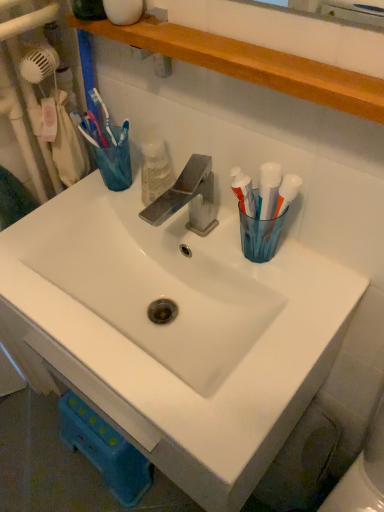
Question: From a real-world perspective, is white ceramic sink at center positioned under translucent plastic toothbrush at upper left based on gravity?

Choices:
 (A) yes
 (B) no

Answer: (A)

Question: From the image's perspective, does white ceramic sink at center appear higher than translucent plastic toothbrush at upper left?

Choices:
 (A) no
 (B) yes

Answer: (A)

Question: Considering the relative positions of white ceramic sink at center and translucent plastic toothbrush at upper left in the image provided, is white ceramic sink at center behind translucent plastic toothbrush at upper left?

Choices:
 (A) yes
 (B) no

Answer: (B)

Question: Is white ceramic sink at center turned away from translucent plastic toothbrush at upper left?

Choices:
 (A) no
 (B) yes

Answer: (A)

Question: Is white ceramic sink at center positioned in front of translucent plastic toothbrush at upper left?

Choices:
 (A) yes
 (B) no

Answer: (A)

Question: Does white ceramic sink at center have a larger size compared to translucent plastic toothbrush at upper left?

Choices:
 (A) yes
 (B) no

Answer: (A)

Question: From the image's perspective, does white ceramic sink at center appear lower than wooden shelf at upper center?

Choices:
 (A) yes
 (B) no

Answer: (A)

Question: Is white ceramic sink at center positioned before wooden shelf at upper center?

Choices:
 (A) yes
 (B) no

Answer: (B)

Question: From a real-world perspective, is white ceramic sink at center physically below wooden shelf at upper center?

Choices:
 (A) no
 (B) yes

Answer: (B)

Question: Does white ceramic sink at center have a lesser width compared to wooden shelf at upper center?

Choices:
 (A) yes
 (B) no

Answer: (B)

Question: Is white ceramic sink at center positioned beyond the bounds of wooden shelf at upper center?

Choices:
 (A) no
 (B) yes

Answer: (B)

Question: From the image's perspective, is white ceramic sink at center on top of wooden shelf at upper center?

Choices:
 (A) no
 (B) yes

Answer: (A)

Question: Is wooden shelf at upper center positioned behind translucent plastic toothbrush at upper left?

Choices:
 (A) yes
 (B) no

Answer: (B)